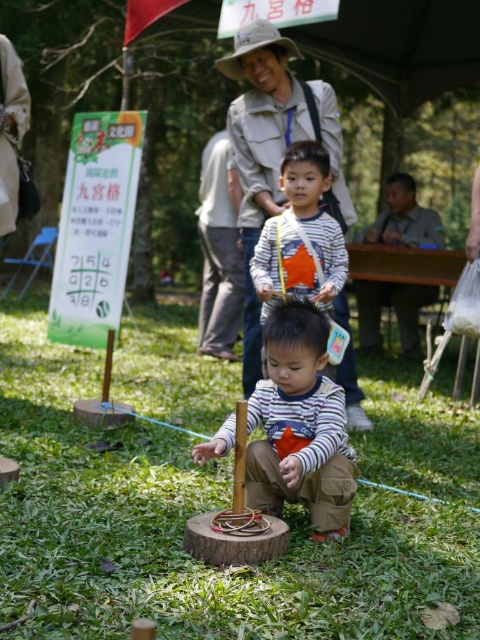
Based on the photo, you are a photographer positioned at the center of the scene. You want to take a photo that includes both the point at coordinates point (313, 404) and point (210, 246). Which point should be placed closer to the front of the photo to ensure both are visible?

Point (313, 404) should be placed closer to the front of the photo because it is in front of point (210, 246), ensuring both are visible without one being obscured.

Based on the photo, you are a photographer trying to capture a candid shot of both the striped cotton shirt at center and the brown leather jacket at right. Based on their positions, can you see both subjects fully in the frame without any obstruction?

The striped cotton shirt at center is in front of the brown leather jacket at right, so the photographer cannot see the brown leather jacket at right fully in the frame because it is partially obstructed by the striped cotton shirt at center.